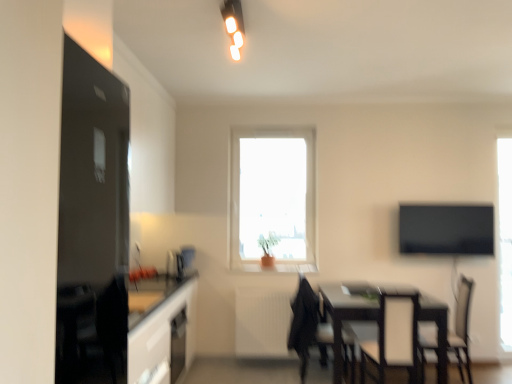
What is the approximate height of black fabric chair at lower right, the 1th chair positioned from the right?

36.54 inches.

Identify the location of transparent glass window at center, which is the 1th window in left-to-right order. (273, 199).

What do you see at coordinates (308, 326) in the screenshot? I see `black leather chair at center, the first chair from the left` at bounding box center [308, 326].

What do you see at coordinates (344, 317) in the screenshot?
I see `dark wood table at lower right` at bounding box center [344, 317].

This screenshot has height=384, width=512. I want to click on dark wood table at lower right, so click(x=344, y=317).

This screenshot has height=384, width=512. What are the coordinates of `white textured radiator at center` in the screenshot? It's located at (262, 323).

In the scene shown: From the image's perspective, is white fabric armchair at lower right located beneath white textured radiator at center?

Actually, white fabric armchair at lower right appears above white textured radiator at center in the image.

From a real-world perspective, between white fabric armchair at lower right and white textured radiator at center, who is vertically lower?

white textured radiator at center is physically lower.

In the image, is white fabric armchair at lower right positioned in front of or behind white textured radiator at center?

Visually, white fabric armchair at lower right is located in front of white textured radiator at center.

Considering the sizes of white fabric armchair at lower right and white textured radiator at center in the image, is white fabric armchair at lower right bigger or smaller than white textured radiator at center?

Considering their sizes, white fabric armchair at lower right takes up more space than white textured radiator at center.

Consider the image. Is black leather chair at center, the 2th chair from the right, facing away from black fabric chair at lower right, the 1th chair positioned from the right?

No.

Is black leather chair at center, the first chair from the left, spatially inside black fabric chair at lower right, the 1th chair positioned from the right, or outside of it?

black leather chair at center, the first chair from the left, is not inside black fabric chair at lower right, the 1th chair positioned from the right, it's outside.

Does black leather chair at center, the first chair from the left, have a greater height compared to black fabric chair at lower right, the second chair positioned from the left?

Yes.

Considering the sizes of objects black glossy tv at right and black glossy fridge at left in the image provided, who is thinner, black glossy tv at right or black glossy fridge at left?

black glossy tv at right is thinner.

Does point (403, 244) lie behind point (126, 345)?

Yes, point (403, 244) is farther from viewer.

You are a GUI agent. You are given a task and a screenshot of the screen. Output one action in this format:
    pyautogui.click(x=<x>, y=<y>)
    Task: Click on the window screen that appears on the right of black glossy fridge at left
    The width and height of the screenshot is (512, 384).
    Given the screenshot: What is the action you would take?
    pyautogui.click(x=446, y=229)

Is black glossy tv at right looking in the opposite direction of black glossy fridge at left?

No.

Is point (232, 15) behind point (288, 294)?

No, it is not.

Is white glossy light fixture at upper center shorter than white textured radiator at center?

Indeed, white glossy light fixture at upper center has a lesser height compared to white textured radiator at center.

Which is behind, white glossy light fixture at upper center or white textured radiator at center?

Positioned behind is white textured radiator at center.

From a real-world perspective, is white glossy light fixture at upper center above or below white textured radiator at center?

white glossy light fixture at upper center is above white textured radiator at center.

What's the angular difference between black leather chair at center, the 2th chair from the right, and black glossy tv at right's facing directions?

There is a 89.6-degree angle between the facing directions of black leather chair at center, the 2th chair from the right, and black glossy tv at right.

In terms of height, does black leather chair at center, the 2th chair from the right, look taller or shorter compared to black glossy tv at right?

black leather chair at center, the 2th chair from the right, is taller than black glossy tv at right.

In the scene shown: Is black leather chair at center, the 2th chair from the right, directly adjacent to black glossy tv at right?

No, black leather chair at center, the 2th chair from the right, is not touching black glossy tv at right.

In the image, is black leather chair at center, the 2th chair from the right, positioned in front of or behind black glossy tv at right?

black leather chair at center, the 2th chair from the right, is positioned closer to the viewer than black glossy tv at right.

Between white fabric armchair at lower right and black fabric chair at lower right, the second chair positioned from the left, which one has more height?

Standing taller between the two is black fabric chair at lower right, the second chair positioned from the left.

Is black fabric chair at lower right, the second chair positioned from the left, located within white fabric armchair at lower right?

That's incorrect, black fabric chair at lower right, the second chair positioned from the left, is not inside white fabric armchair at lower right.

Is white fabric armchair at lower right aimed at black fabric chair at lower right, the 1th chair positioned from the right?

No, white fabric armchair at lower right is not oriented towards black fabric chair at lower right, the 1th chair positioned from the right.

Does point (396, 320) appear closer or farther from the camera than point (466, 278)?

Point (396, 320) is closer to the camera than point (466, 278).

Would you say white fabric armchair at lower right is outside black glossy fridge at left?

Yes, white fabric armchair at lower right is outside of black glossy fridge at left.

From the image's perspective, relative to black glossy fridge at left, is white fabric armchair at lower right above or below?

From the image's perspective, white fabric armchair at lower right appears below black glossy fridge at left.

Based on the photo, between white fabric armchair at lower right and black glossy fridge at left, which one has smaller width?

black glossy fridge at left.

How different are the orientations of white fabric armchair at lower right and black glossy fridge at left in degrees?

They differ by 88.1 degrees in their facing directions.

I want to click on radiator on the left of the white fabric armchair at lower right, so click(x=262, y=323).

In order to click on chair below the black leather chair at center, the 2th chair from the right (from the image's perspective) in this screenshot , I will do `click(462, 325)`.

Considering their positions, is black leather chair at center, the first chair from the left, positioned further to black glossy fridge at left than white glossy light fixture at upper center?

white glossy light fixture at upper center lies further to black glossy fridge at left than the other object.

Considering their positions, is black leather chair at center, the first chair from the left, positioned further to black glossy fridge at left than white fabric armchair at lower right?

Among the two, white fabric armchair at lower right is located further to black glossy fridge at left.

Considering their positions, is white textured radiator at center positioned further to transparent glass window at right, the second window positioned from the left, than black glossy fridge at left?

black glossy fridge at left is positioned further to the anchor transparent glass window at right, the second window positioned from the left.

Considering their positions, is black fabric chair at lower right, the 1th chair positioned from the right, positioned closer to white textured radiator at center than black glossy tv at right?

black fabric chair at lower right, the 1th chair positioned from the right, is positioned closer to the anchor white textured radiator at center.

When comparing their distances from white glossy light fixture at upper center, does black fabric chair at lower right, the 1th chair positioned from the right, or black glossy tv at right seem closer?

black glossy tv at right is positioned closer to the anchor white glossy light fixture at upper center.

Consider the image. From the image, which object appears to be farther from white fabric armchair at lower right, dark wood table at lower right or white textured radiator at center?

Among the two, white textured radiator at center is located further to white fabric armchair at lower right.

Based on the photo, when comparing their distances from black glossy fridge at left, does black fabric chair at lower right, the second chair positioned from the left, or white textured radiator at center seem closer?

white textured radiator at center lies closer to black glossy fridge at left than the other object.

When comparing their distances from black glossy fridge at left, does dark wood table at lower right or black glossy tv at right seem further?

The object further to black glossy fridge at left is black glossy tv at right.

Locate an element on the screen. Image resolution: width=512 pixels, height=384 pixels. light fixture between black glossy fridge at left and transparent glass window at right, which is the first window from right to left is located at coordinates (234, 25).

In order to click on window screen between white glossy light fixture at upper center and white textured radiator at center vertically in this screenshot , I will do `click(446, 229)`.

This screenshot has width=512, height=384. In order to click on table situated between black leather chair at center, the first chair from the left, and black glossy tv at right from left to right in this screenshot , I will do `click(344, 317)`.

What are the coordinates of `table between white textured radiator at center and black fabric chair at lower right, the second chair positioned from the left` in the screenshot? It's located at (344, 317).